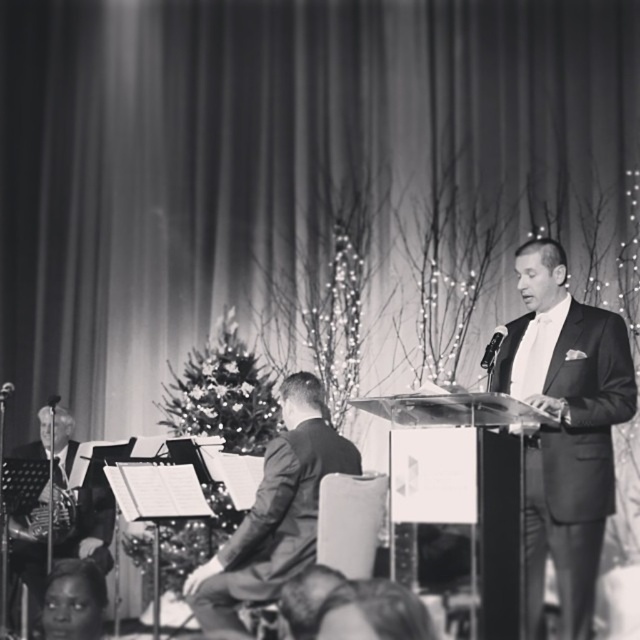
You are at the event and want to move from point A to point B. Given that point A is at coordinates point [484,365] and point B is at coordinates point [54,397], which point is closer to you when you first arrive at the event?

A: Point [484,365] is closer to the viewer than point [54,397], so point A is closer when you first arrive at the event.